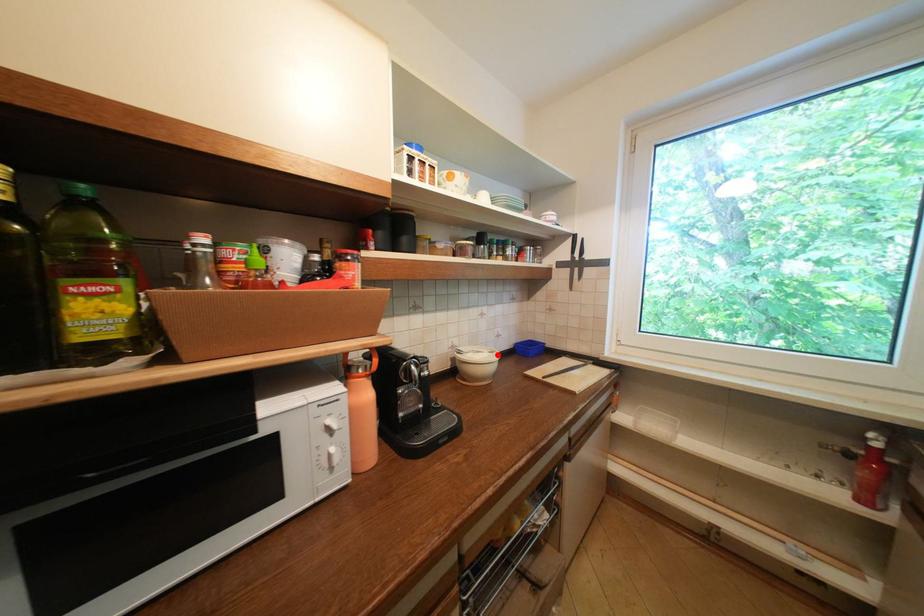
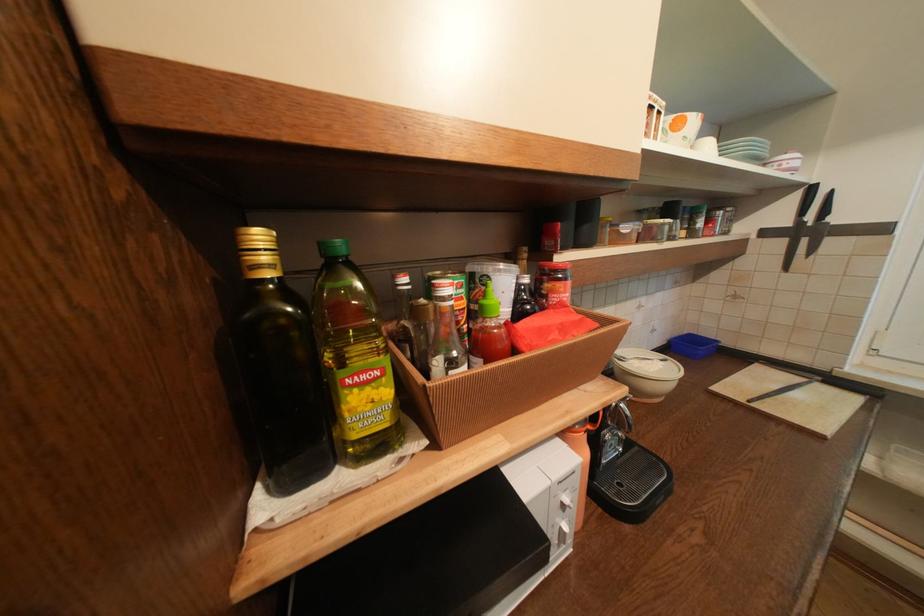
In the second image, find the point that corresponds to the highlighted location in the first image.

(670, 363)